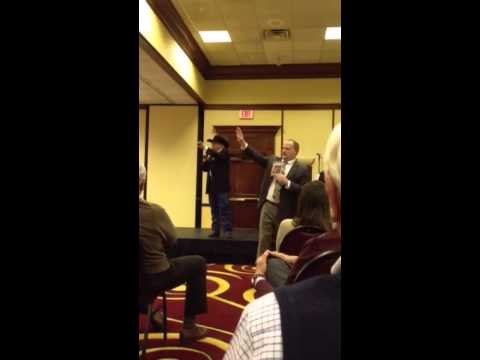
Where is `vents`? This screenshot has height=360, width=480. vents is located at coordinates (289, 34).